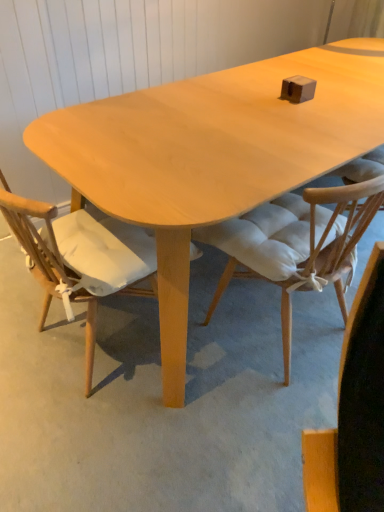
Question: Is light wood chair at center, which is the 2th chair in right-to-left order, not close to white padded chair at center, which appears as the 1th chair when viewed from the right?

Choices:
 (A) yes
 (B) no

Answer: (B)

Question: From the image's perspective, is light wood chair at center, the 1th chair from the left, on top of white padded chair at center, which appears as the 1th chair when viewed from the right?

Choices:
 (A) no
 (B) yes

Answer: (A)

Question: Considering the relative sizes of light wood chair at center, the 1th chair from the left, and white padded chair at center, which appears as the 1th chair when viewed from the right, in the image provided, is light wood chair at center, the 1th chair from the left, taller than white padded chair at center, which appears as the 1th chair when viewed from the right,?

Choices:
 (A) yes
 (B) no

Answer: (A)

Question: Considering the relative positions of light wood chair at center, the 1th chair from the left, and white padded chair at center, placed as the 2th chair when sorted from left to right, in the image provided, is light wood chair at center, the 1th chair from the left, to the right of white padded chair at center, placed as the 2th chair when sorted from left to right, from the viewer's perspective?

Choices:
 (A) yes
 (B) no

Answer: (B)

Question: Does light wood chair at center, which is the 2th chair in right-to-left order, turn towards white padded chair at center, which appears as the 1th chair when viewed from the right?

Choices:
 (A) yes
 (B) no

Answer: (B)

Question: From the image's perspective, is light wood chair at center, which is the 2th chair in right-to-left order, beneath white padded chair at center, which appears as the 1th chair when viewed from the right?

Choices:
 (A) no
 (B) yes

Answer: (B)

Question: From the image's perspective, is white padded chair at center, placed as the 2th chair when sorted from left to right, located above light wood chair at center, the 1th chair from the left?

Choices:
 (A) no
 (B) yes

Answer: (B)

Question: Are white padded chair at center, which appears as the 1th chair when viewed from the right, and light wood chair at center, the 1th chair from the left, located far from each other?

Choices:
 (A) yes
 (B) no

Answer: (B)

Question: Is white padded chair at center, which appears as the 1th chair when viewed from the right, beside light wood chair at center, the 1th chair from the left?

Choices:
 (A) no
 (B) yes

Answer: (A)

Question: Is white padded chair at center, which appears as the 1th chair when viewed from the right, looking in the opposite direction of light wood chair at center, the 1th chair from the left?

Choices:
 (A) yes
 (B) no

Answer: (B)

Question: Is white padded chair at center, which appears as the 1th chair when viewed from the right, outside of light wood chair at center, which is the 2th chair in right-to-left order?

Choices:
 (A) yes
 (B) no

Answer: (A)

Question: Does white padded chair at center, placed as the 2th chair when sorted from left to right, lie in front of light wood chair at center, the 1th chair from the left?

Choices:
 (A) yes
 (B) no

Answer: (B)

Question: Is light wood chair at center, the 1th chair from the left, wider or thinner than white padded chair at center, placed as the 2th chair when sorted from left to right?

Choices:
 (A) thin
 (B) wide

Answer: (B)